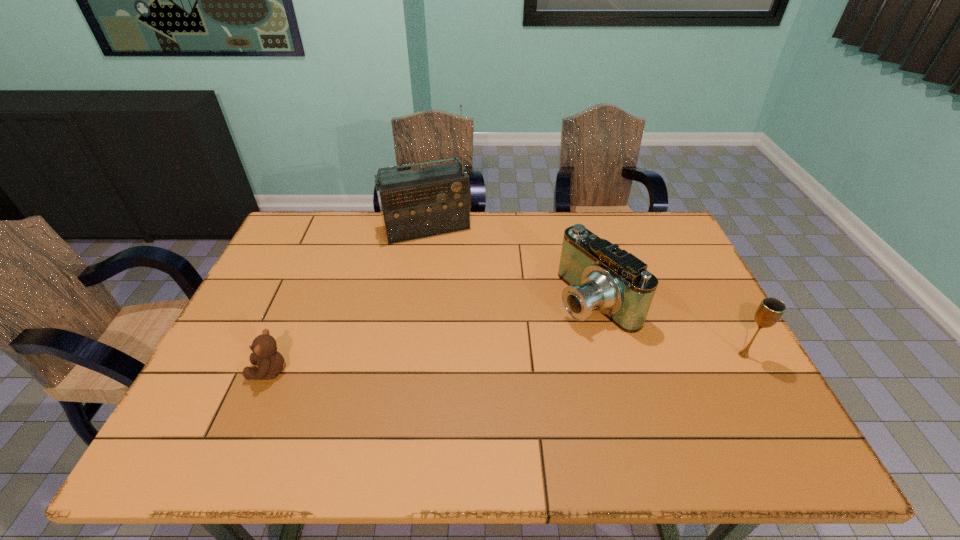
You are a GUI agent. You are given a task and a screenshot of the screen. Output one action in this format:
    pyautogui.click(x=<x>, y=<y>)
    Task: Click on the object positioned at the near left corner
    The height and width of the screenshot is (540, 960).
    Given the screenshot: What is the action you would take?
    pyautogui.click(x=270, y=362)

What are the coordinates of `free space at the far edge of the desktop` in the screenshot? It's located at (594, 213).

Locate an element on the screen. free space at the near edge of the desktop is located at coordinates (519, 400).

Where is `free space at the left edge of the desktop`? free space at the left edge of the desktop is located at coordinates (291, 324).

Locate an element on the screen. free space at the right edge is located at coordinates (701, 369).

In the image, there is a desktop. At what (x,y) coordinates should I click in order to perform the action: click on free region at the far left corner. Please return your answer as a coordinate pair (x, y). Looking at the image, I should click on (293, 253).

The image size is (960, 540). In the image, there is a desktop. Find the location of `free space at the near right corner`. free space at the near right corner is located at coordinates (722, 402).

Locate an element on the screen. Image resolution: width=960 pixels, height=540 pixels. vacant region between the rightmost object and the camcorder is located at coordinates (669, 327).

I want to click on free space between the teddy bear and the rightmost object, so click(507, 363).

Image resolution: width=960 pixels, height=540 pixels. I want to click on empty location between the third nearest object and the radio receiver, so click(x=511, y=264).